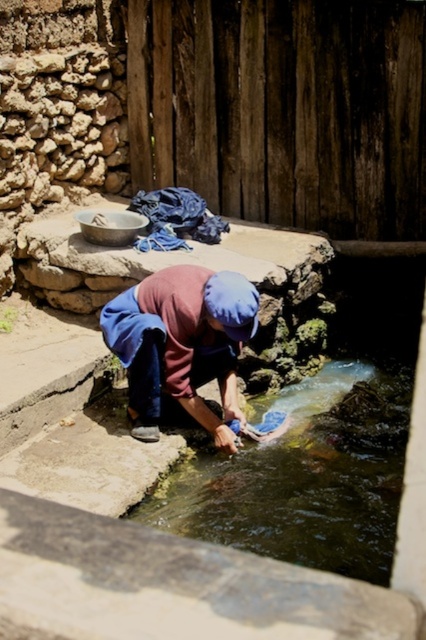
Question: Does blue fabric at center appear over blue fabric at upper center?

Choices:
 (A) no
 (B) yes

Answer: (A)

Question: Does clear water stream at center have a greater width compared to blue fabric at center?

Choices:
 (A) no
 (B) yes

Answer: (B)

Question: Is blue fabric at center further to camera compared to blue fabric at upper center?

Choices:
 (A) no
 (B) yes

Answer: (A)

Question: Which point is farther to the camera?

Choices:
 (A) (193, 211)
 (B) (296, 529)
 (C) (229, 442)

Answer: (A)

Question: Among these points, which one is farthest from the camera?

Choices:
 (A) (336, 566)
 (B) (187, 392)
 (C) (213, 228)

Answer: (C)

Question: Which point is closer to the camera?

Choices:
 (A) (250, 534)
 (B) (199, 224)
 (C) (114, 337)

Answer: (A)